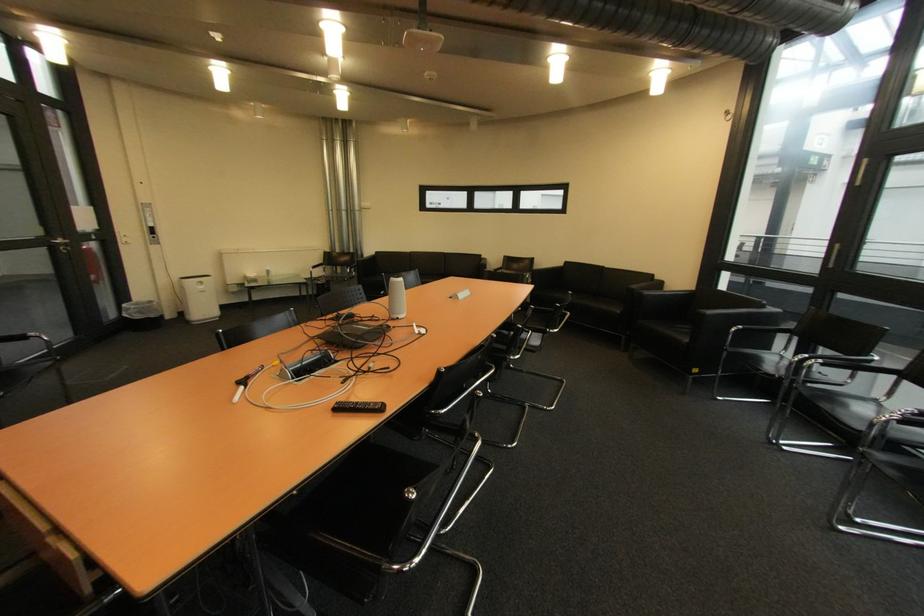
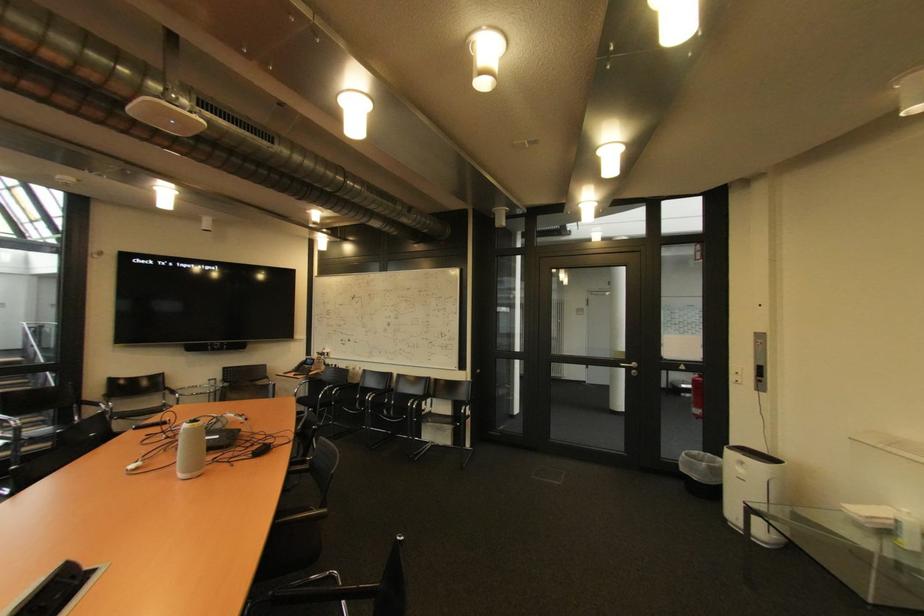
Find the pixel in the second image that matches (x=209, y=288) in the first image.

(748, 471)